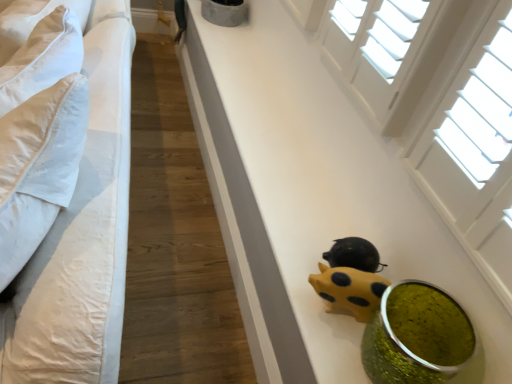
Question: Would you say white cotton bed at left is outside yellow matte piggy bank at lower center?

Choices:
 (A) yes
 (B) no

Answer: (A)

Question: Does white cotton bed at left have a smaller size compared to yellow matte piggy bank at lower center?

Choices:
 (A) yes
 (B) no

Answer: (B)

Question: Is the surface of white cotton bed at left in direct contact with yellow matte piggy bank at lower center?

Choices:
 (A) yes
 (B) no

Answer: (B)

Question: Considering the relative sizes of white cotton bed at left and yellow matte piggy bank at lower center in the image provided, is white cotton bed at left thinner than yellow matte piggy bank at lower center?

Choices:
 (A) no
 (B) yes

Answer: (A)

Question: From a real-world perspective, does white cotton bed at left sit lower than yellow matte piggy bank at lower center?

Choices:
 (A) yes
 (B) no

Answer: (A)

Question: From the image's perspective, would you say white cotton bed at left is positioned over yellow matte piggy bank at lower center?

Choices:
 (A) yes
 (B) no

Answer: (B)

Question: Is yellow matte piggy bank at lower center oriented away from yellow matte piggy bank at lower center?

Choices:
 (A) no
 (B) yes

Answer: (A)

Question: Does yellow matte piggy bank at lower center appear on the left side of yellow matte piggy bank at lower center?

Choices:
 (A) yes
 (B) no

Answer: (A)

Question: Considering the relative positions of yellow matte piggy bank at lower center and yellow matte piggy bank at lower center in the image provided, is yellow matte piggy bank at lower center to the right of yellow matte piggy bank at lower center from the viewer's perspective?

Choices:
 (A) no
 (B) yes

Answer: (A)

Question: Considering the relative sizes of yellow matte piggy bank at lower center and yellow matte piggy bank at lower center in the image provided, is yellow matte piggy bank at lower center thinner than yellow matte piggy bank at lower center?

Choices:
 (A) yes
 (B) no

Answer: (B)

Question: Considering the relative sizes of yellow matte piggy bank at lower center and yellow matte piggy bank at lower center in the image provided, is yellow matte piggy bank at lower center taller than yellow matte piggy bank at lower center?

Choices:
 (A) yes
 (B) no

Answer: (B)

Question: Does yellow matte piggy bank at lower center lie behind yellow matte piggy bank at lower center?

Choices:
 (A) no
 (B) yes

Answer: (A)

Question: From the image's perspective, would you say white cotton bed at left is positioned over green glittery vase at lower right?

Choices:
 (A) no
 (B) yes

Answer: (B)